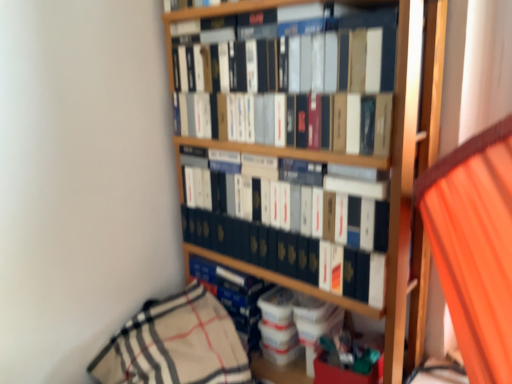
Find the location of `orange fabric curtain at right`. orange fabric curtain at right is located at coordinates (475, 246).

Describe the element at coordinates (383, 63) in the screenshot. I see `matte black book at upper center, which appears as the 1th book when viewed from the top` at that location.

Measure the distance between matte black book at center, which is the 2th book in top-to-bottom order, and camera.

They are 29.96 inches apart.

Identify the location of orange fabric curtain at right. The image size is (512, 384). (475, 246).

Is blue hardcover book at center, the 3th book from the top, far from matte black book at upper center, the 3th book in the bottom-to-top sequence?

blue hardcover book at center, the 3th book from the top, is actually quite close to matte black book at upper center, the 3th book in the bottom-to-top sequence.

Find the location of a particular element. The image size is (512, 384). the 2nd book in front of the blue hardcover book at center, the 3th book from the top is located at coordinates (383, 63).

Does blue hardcover book at center, which appears as the 1th book when ordered from the bottom, have a greater width compared to matte black book at upper center, the 3th book in the bottom-to-top sequence?

Correct, the width of blue hardcover book at center, which appears as the 1th book when ordered from the bottom, exceeds that of matte black book at upper center, the 3th book in the bottom-to-top sequence.

Would you say blue hardcover book at center, the 3th book from the top, is outside matte black book at upper center, the 3th book in the bottom-to-top sequence?

Yes, blue hardcover book at center, the 3th book from the top, is outside of matte black book at upper center, the 3th book in the bottom-to-top sequence.

Choose the correct answer: Is orange fabric curtain at right inside matte black book at upper center, which appears as the 1th book when viewed from the top, or outside it?

orange fabric curtain at right is outside matte black book at upper center, which appears as the 1th book when viewed from the top.

In the scene shown: Would you say orange fabric curtain at right is a long distance from matte black book at upper center, which appears as the 1th book when viewed from the top?

No, orange fabric curtain at right is not far away from matte black book at upper center, which appears as the 1th book when viewed from the top.

From the image's perspective, between orange fabric curtain at right and matte black book at upper center, which appears as the 1th book when viewed from the top, which one is located above?

matte black book at upper center, which appears as the 1th book when viewed from the top, is shown above in the image.

Is orange fabric curtain at right oriented away from matte black book at upper center, the 3th book in the bottom-to-top sequence?

No, orange fabric curtain at right is not facing away from matte black book at upper center, the 3th book in the bottom-to-top sequence.

Does matte black book at upper center, the 3th book in the bottom-to-top sequence, come behind matte black book at center, which is the 2th book in top-to-bottom order?

No, it is in front of matte black book at center, which is the 2th book in top-to-bottom order.

Which is more to the right, matte black book at upper center, the 3th book in the bottom-to-top sequence, or matte black book at center, which is the 2th book in top-to-bottom order?

From the viewer's perspective, matte black book at center, which is the 2th book in top-to-bottom order, appears more on the right side.

How far apart are matte black book at upper center, which appears as the 1th book when viewed from the top, and matte black book at center, which is the 2th book in top-to-bottom order?

matte black book at upper center, which appears as the 1th book when viewed from the top, is 9.10 inches from matte black book at center, which is the 2th book in top-to-bottom order.

What's the angular difference between matte black book at upper center, which appears as the 1th book when viewed from the top, and matte black book at center, which is the 2th book in top-to-bottom order,'s facing directions?

0.000254 degrees separate the facing orientations of matte black book at upper center, which appears as the 1th book when viewed from the top, and matte black book at center, which is the 2th book in top-to-bottom order.

Considering the sizes of blue hardcover book at center, the 3th book from the top, and matte black book at center, the 2th book from the bottom, in the image, is blue hardcover book at center, the 3th book from the top, wider or thinner than matte black book at center, the 2th book from the bottom,?

Considering their sizes, blue hardcover book at center, the 3th book from the top, looks broader than matte black book at center, the 2th book from the bottom.

Is there a large distance between blue hardcover book at center, which appears as the 1th book when ordered from the bottom, and matte black book at center, the 2th book from the bottom?

No, blue hardcover book at center, which appears as the 1th book when ordered from the bottom, is not far from matte black book at center, the 2th book from the bottom.

Where is `the 2nd book to the left when counting from the matte black book at center, the 2th book from the bottom`? The width and height of the screenshot is (512, 384). the 2nd book to the left when counting from the matte black book at center, the 2th book from the bottom is located at coordinates (233, 295).

Is blue hardcover book at center, which appears as the 1th book when ordered from the bottom, looking in the opposite direction of matte black book at center, the 2th book from the bottom?

No, blue hardcover book at center, which appears as the 1th book when ordered from the bottom,'s orientation is not away from matte black book at center, the 2th book from the bottom.

Is matte black book at upper center, which appears as the 1th book when viewed from the top, not near orange fabric curtain at right?

matte black book at upper center, which appears as the 1th book when viewed from the top, is actually quite close to orange fabric curtain at right.

At what (x,y) coordinates should I click in order to perform the action: click on curtain that appears in front of the matte black book at upper center, the 3th book in the bottom-to-top sequence. Please return your answer as a coordinate pair (x, y). This screenshot has height=384, width=512. Looking at the image, I should click on (475, 246).

Consider the image. From a real-world perspective, who is located lower, matte black book at upper center, which appears as the 1th book when viewed from the top, or orange fabric curtain at right?

In real-world perspective, orange fabric curtain at right is lower.

From the picture: Is matte black book at center, which is the 2th book in top-to-bottom order, further to the viewer compared to matte black book at upper center, which appears as the 1th book when viewed from the top?

Yes, it is behind matte black book at upper center, which appears as the 1th book when viewed from the top.

In the scene shown: How many degrees apart are the facing directions of matte black book at center, which is the 2th book in top-to-bottom order, and matte black book at upper center, the 3th book in the bottom-to-top sequence?

The facing directions of matte black book at center, which is the 2th book in top-to-bottom order, and matte black book at upper center, the 3th book in the bottom-to-top sequence, are 0.000254 degrees apart.

Is matte black book at center, which is the 2th book in top-to-bottom order, facing away from matte black book at upper center, which appears as the 1th book when viewed from the top?

No, matte black book at center, which is the 2th book in top-to-bottom order, is not facing the opposite direction of matte black book at upper center, which appears as the 1th book when viewed from the top.

Consider the image. Who is shorter, matte black book at center, the 2th book from the bottom, or matte black book at upper center, the 3th book in the bottom-to-top sequence?

matte black book at center, the 2th book from the bottom, is shorter.

Does blue hardcover book at center, which appears as the 1th book when ordered from the bottom, turn towards orange fabric curtain at right?

No.

Is blue hardcover book at center, which appears as the 1th book when ordered from the bottom, not near orange fabric curtain at right?

Actually, blue hardcover book at center, which appears as the 1th book when ordered from the bottom, and orange fabric curtain at right are a little close together.

Considering the positions of objects blue hardcover book at center, the 3th book from the top, and orange fabric curtain at right in the image provided, who is more to the left, blue hardcover book at center, the 3th book from the top, or orange fabric curtain at right?

Positioned to the left is blue hardcover book at center, the 3th book from the top.

At what (x,y) coordinates should I click in order to perform the action: click on the 2nd book behind when counting from the matte black book at upper center, the 3th book in the bottom-to-top sequence. Please return your answer as a coordinate pair (x, y). The height and width of the screenshot is (384, 512). Looking at the image, I should click on (233, 295).

This screenshot has width=512, height=384. I want to click on curtain that is below the matte black book at upper center, which appears as the 1th book when viewed from the top (from the image's perspective), so click(x=475, y=246).

Which object lies further to the anchor point orange fabric curtain at right, matte black book at center, which is the 2th book in top-to-bottom order, or matte black book at upper center, the 3th book in the bottom-to-top sequence?

Based on the image, matte black book at upper center, the 3th book in the bottom-to-top sequence, appears to be further to orange fabric curtain at right.

Estimate the real-world distances between objects in this image. Which object is closer to orange fabric curtain at right, matte black book at upper center, which appears as the 1th book when viewed from the top, or blue hardcover book at center, which appears as the 1th book when ordered from the bottom?

Based on the image, matte black book at upper center, which appears as the 1th book when viewed from the top, appears to be nearer to orange fabric curtain at right.

From the image, which object appears to be nearer to matte black book at center, the 2th book from the bottom, matte black book at upper center, the 3th book in the bottom-to-top sequence, or orange fabric curtain at right?

Among the two, matte black book at upper center, the 3th book in the bottom-to-top sequence, is located nearer to matte black book at center, the 2th book from the bottom.

Considering their positions, is orange fabric curtain at right positioned further to blue hardcover book at center, which appears as the 1th book when ordered from the bottom, than matte black book at upper center, which appears as the 1th book when viewed from the top?

orange fabric curtain at right lies further to blue hardcover book at center, which appears as the 1th book when ordered from the bottom, than the other object.

Estimate the real-world distances between objects in this image. Which object is closer to matte black book at upper center, the 3th book in the bottom-to-top sequence, matte black book at center, the 2th book from the bottom, or blue hardcover book at center, the 3th book from the top?

Among the two, matte black book at center, the 2th book from the bottom, is located nearer to matte black book at upper center, the 3th book in the bottom-to-top sequence.

Considering their positions, is matte black book at upper center, the 3th book in the bottom-to-top sequence, positioned further to blue hardcover book at center, the 3th book from the top, than orange fabric curtain at right?

orange fabric curtain at right lies further to blue hardcover book at center, the 3th book from the top, than the other object.

Considering their positions, is blue hardcover book at center, which appears as the 1th book when ordered from the bottom, positioned further to orange fabric curtain at right than matte black book at upper center, the 3th book in the bottom-to-top sequence?

blue hardcover book at center, which appears as the 1th book when ordered from the bottom, is further to orange fabric curtain at right.

Estimate the real-world distances between objects in this image. Which object is further from matte black book at center, the 2th book from the bottom, blue hardcover book at center, which appears as the 1th book when ordered from the bottom, or matte black book at upper center, the 3th book in the bottom-to-top sequence?

The object further to matte black book at center, the 2th book from the bottom, is matte black book at upper center, the 3th book in the bottom-to-top sequence.

What are the coordinates of `book between matte black book at upper center, the 3th book in the bottom-to-top sequence, and orange fabric curtain at right, in the horizontal direction` in the screenshot? It's located at (275, 245).

Where is `book that lies between matte black book at upper center, the 3th book in the bottom-to-top sequence, and blue hardcover book at center, which appears as the 1th book when ordered from the bottom, from top to bottom`? This screenshot has height=384, width=512. book that lies between matte black book at upper center, the 3th book in the bottom-to-top sequence, and blue hardcover book at center, which appears as the 1th book when ordered from the bottom, from top to bottom is located at coordinates (275, 245).